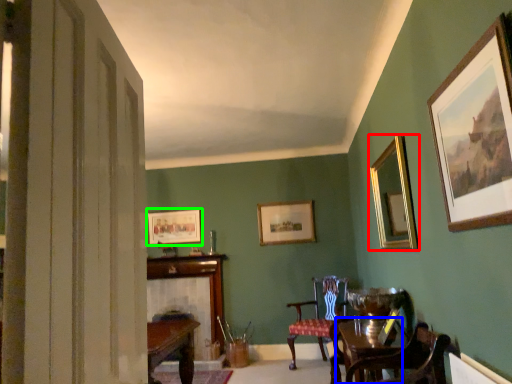
Question: Based on their relative distances, which object is nearer to picture frame (highlighted by a red box)? Choose from round table (highlighted by a blue box) and picture frame (highlighted by a green box).

Choices:
 (A) round table
 (B) picture frame

Answer: (A)